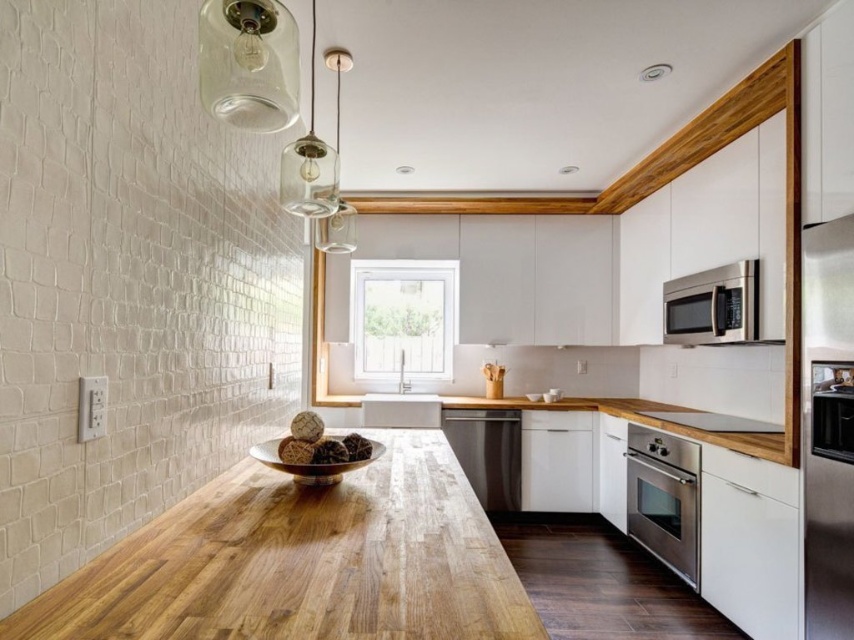
Between point (804, 632) and point (654, 554), which one is positioned in front?

Positioned in front is point (804, 632).

Between satin stainless steel microwave at upper right and stainless steel oven at lower right, which one has less height?

stainless steel oven at lower right is shorter.

Is point (851, 552) positioned before point (677, 445)?

Yes, it is in front of point (677, 445).

Find the location of a particular element. satin stainless steel microwave at upper right is located at coordinates [x=828, y=428].

Can you confirm if satin stainless steel microwave at upper right is bigger than wooden countertop at center?

No, satin stainless steel microwave at upper right is not bigger than wooden countertop at center.

Measure the distance from satin stainless steel microwave at upper right to wooden countertop at center.

The distance of satin stainless steel microwave at upper right from wooden countertop at center is 23.16 inches.

Does point (829, 534) come farther from viewer compared to point (779, 440)?

No, (829, 534) is closer to viewer.

In order to click on satin stainless steel microwave at upper right in this screenshot , I will do `click(828, 428)`.

Between wooden countertop at center and satin silver microwave at upper right, which one appears on the right side from the viewer's perspective?

Positioned to the right is satin silver microwave at upper right.

Can you confirm if wooden countertop at center is positioned to the right of satin silver microwave at upper right?

In fact, wooden countertop at center is to the left of satin silver microwave at upper right.

Locate an element on the screen. The image size is (854, 640). wooden countertop at center is located at coordinates (662, 422).